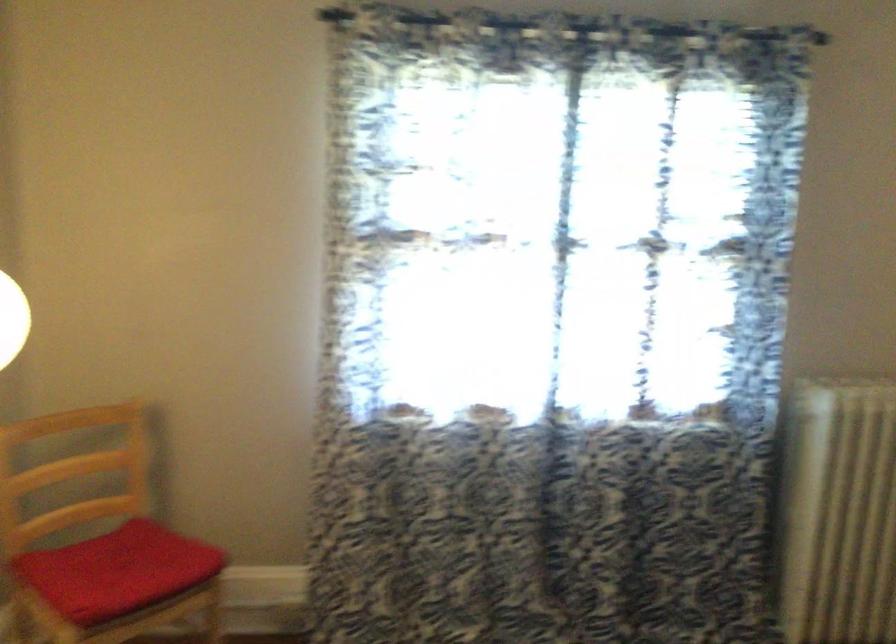
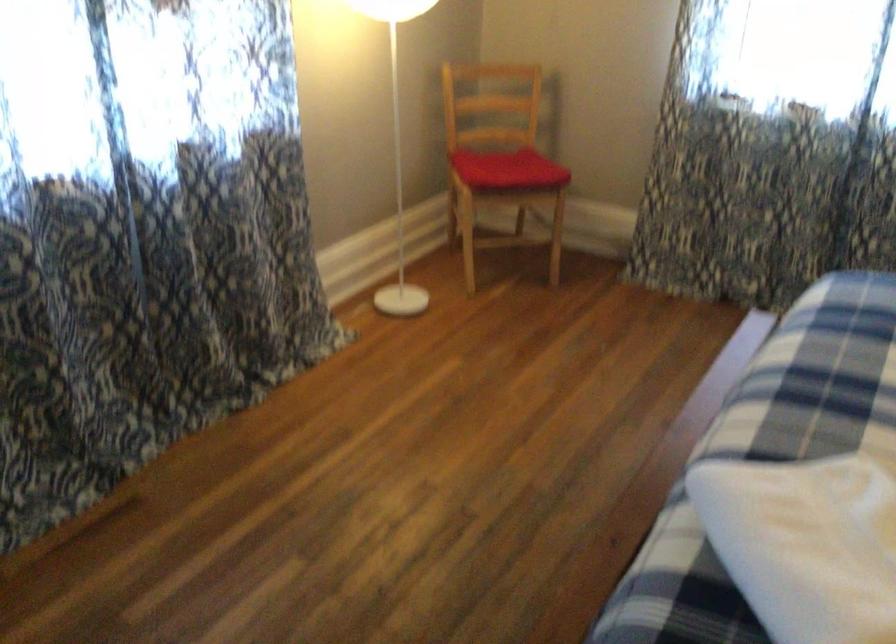
The point at (132, 567) is marked in the first image. Where is the corresponding point in the second image?

(507, 169)